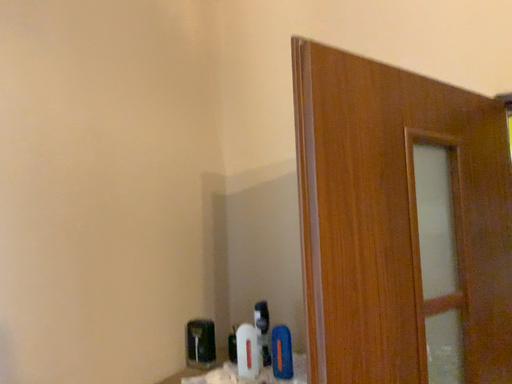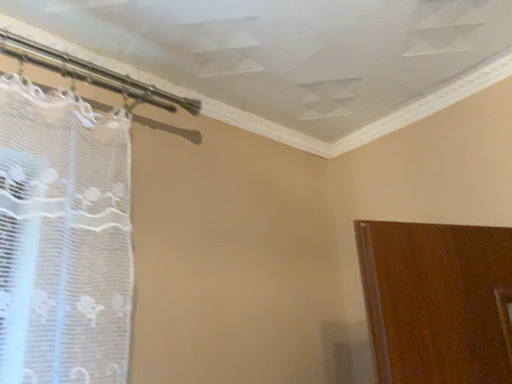
Question: How did the camera likely rotate when shooting the video?

Choices:
 (A) rotated right
 (B) rotated left

Answer: (B)